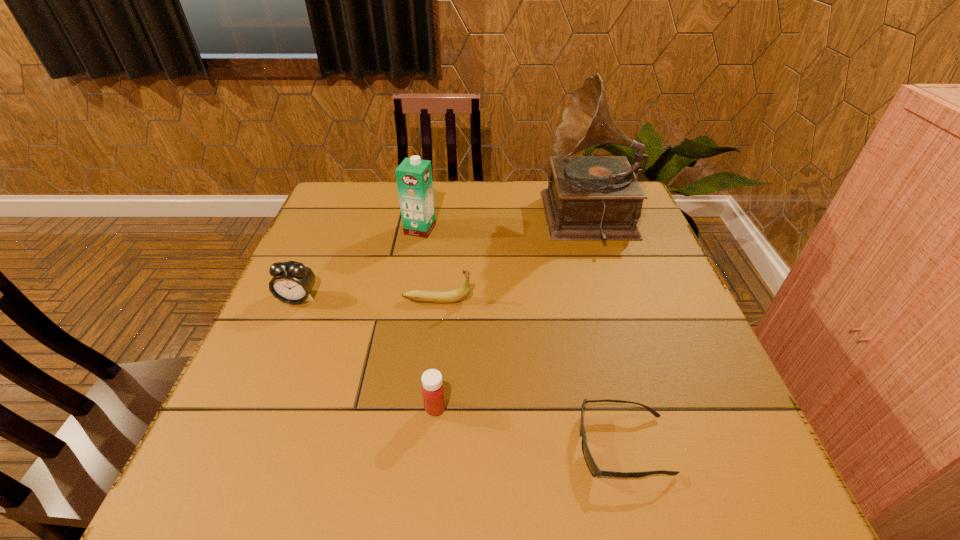
Locate an element on the screen. The width and height of the screenshot is (960, 540). record player that is at the right edge is located at coordinates (589, 198).

At what (x,y) coordinates should I click in order to perform the action: click on sunglasses at the right edge. Please return your answer as a coordinate pair (x, y). The width and height of the screenshot is (960, 540). Looking at the image, I should click on 593,468.

This screenshot has width=960, height=540. I want to click on object that is at the far right corner, so click(589, 198).

This screenshot has width=960, height=540. Identify the location of object at the near right corner. (593, 468).

At what (x,y) coordinates should I click in order to perform the action: click on free point at the far edge. Please return your answer as a coordinate pair (x, y). Looking at the image, I should click on (468, 212).

Where is `vacant area at the near edge of the desktop`? Image resolution: width=960 pixels, height=540 pixels. vacant area at the near edge of the desktop is located at coordinates (519, 500).

The width and height of the screenshot is (960, 540). In the image, there is a desktop. Identify the location of vacant space at the left edge. (330, 237).

The height and width of the screenshot is (540, 960). In order to click on blank space at the right edge in this screenshot , I will do `click(678, 433)`.

Where is `vacant area that lies between the shortest object and the banana`? vacant area that lies between the shortest object and the banana is located at coordinates pos(530,373).

Where is `free space between the carton and the sunglasses`? free space between the carton and the sunglasses is located at coordinates (521, 338).